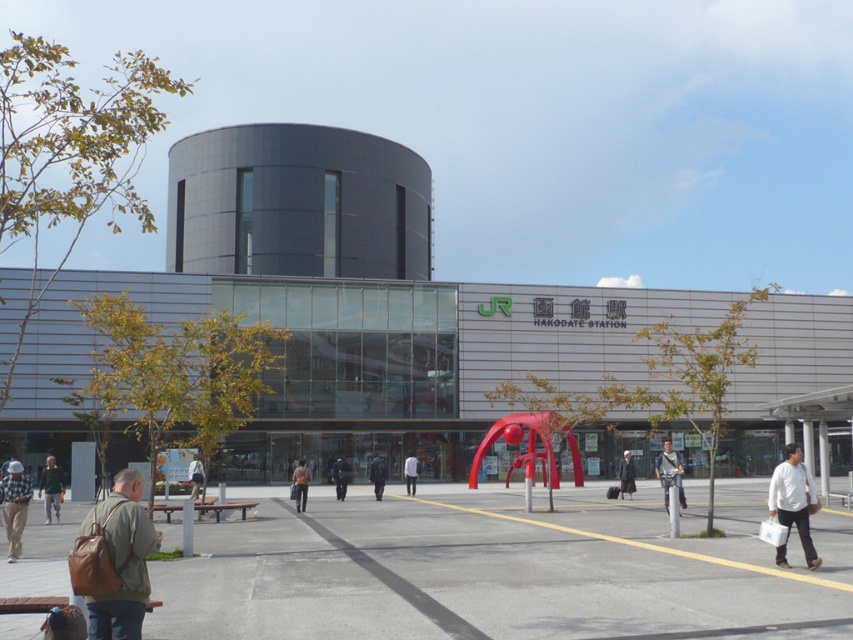
Is orange fabric bag at center wider than light brown leather jacket at center?

In fact, orange fabric bag at center might be narrower than light brown leather jacket at center.

Who is more forward, (306, 477) or (194, 493)?

Point (194, 493) is more forward.

The height and width of the screenshot is (640, 853). What do you see at coordinates (300, 484) in the screenshot?
I see `orange fabric bag at center` at bounding box center [300, 484].

This screenshot has height=640, width=853. I want to click on orange fabric bag at center, so click(300, 484).

Can you confirm if checkered fabric shirt at lower left is positioned below light beige fabric coat at center?

No, checkered fabric shirt at lower left is not below light beige fabric coat at center.

Does checkered fabric shirt at lower left appear on the right side of light beige fabric coat at center?

In fact, checkered fabric shirt at lower left is to the left of light beige fabric coat at center.

Is point (15, 474) positioned before point (622, 456)?

That is True.

You are a GUI agent. You are given a task and a screenshot of the screen. Output one action in this format:
    pyautogui.click(x=<x>, y=<y>)
    Task: Click on the checkered fabric shirt at lower left
    The width and height of the screenshot is (853, 640).
    Given the screenshot: What is the action you would take?
    pyautogui.click(x=15, y=506)

Can you confirm if checkered fabric shirt at lower left is wider than orange fabric bag at center?

In fact, checkered fabric shirt at lower left might be narrower than orange fabric bag at center.

Which is more to the right, checkered fabric shirt at lower left or orange fabric bag at center?

orange fabric bag at center is more to the right.

Describe the element at coordinates (15, 506) in the screenshot. The image size is (853, 640). I see `checkered fabric shirt at lower left` at that location.

At what (x,y) coordinates should I click in order to perform the action: click on checkered fabric shirt at lower left. Please return your answer as a coordinate pair (x, y). The height and width of the screenshot is (640, 853). Looking at the image, I should click on (15, 506).